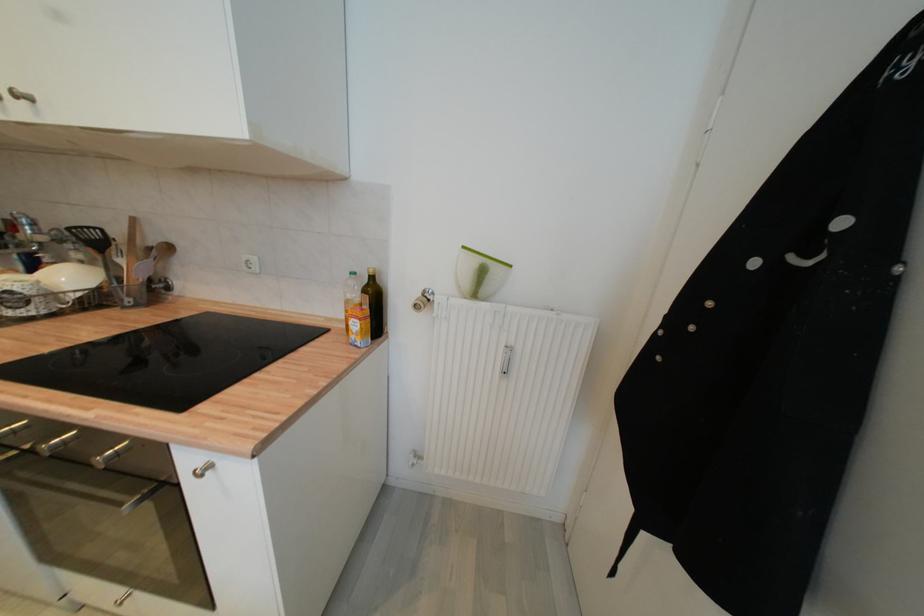
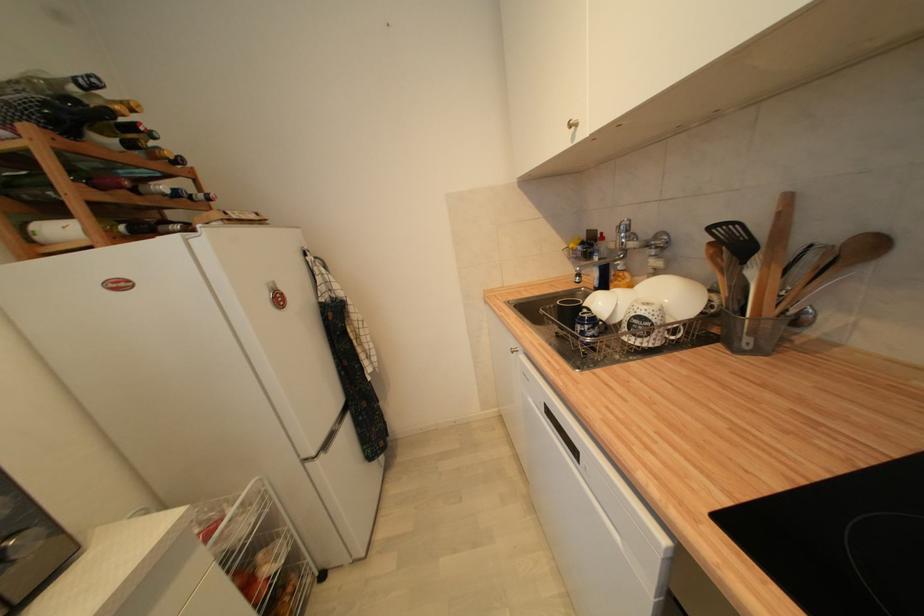
In the second image, find the point that corresponds to (74,230) in the first image.

(715, 230)